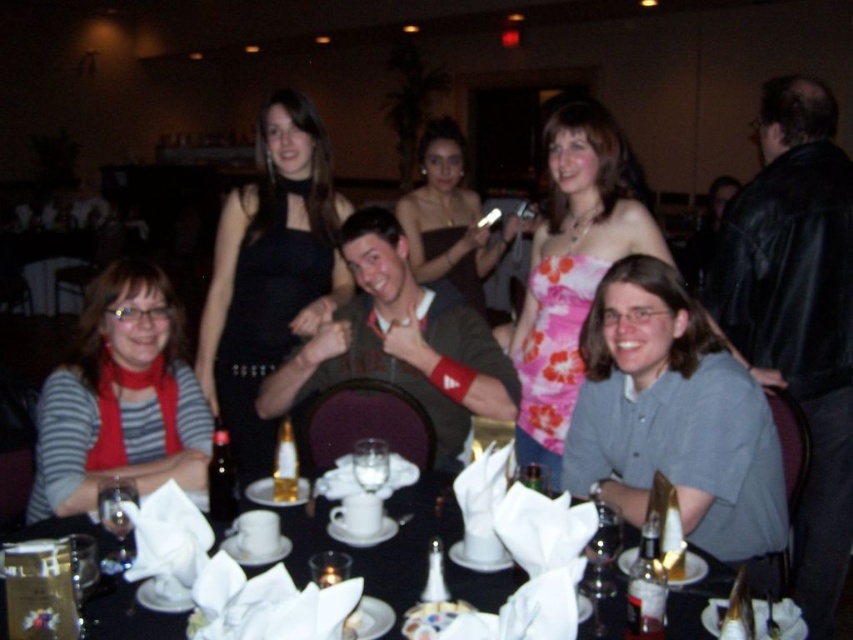
You are a photographer standing at the camera position. You want to take a photo of the person wearing the matte black dress at left. Considering the distance between you and the dress, will you be able to capture the entire dress in your shot without zooming in?

The distance between the matte black dress at left and the camera is 1.78 meters. Whether you can capture the entire dress without zooming depends on your camera lens. If your lens has a wide enough angle to cover the dress at that distance, then yes. Otherwise, you might need to adjust your position or use a wider lens.

You are a photographer at the event and need to capture a clear photo of the black satin dress at center without the matte black dress at center blocking it. Based on their positions, is this possible?

The black satin dress at center is in front of the matte black dress at center, so it is possible to capture a clear photo of the black satin dress at center without the matte black dress at center blocking it.

You are a photographer at the event and need to adjust the seating arrangement to ensure all guests can be captured in a group photo. The photographer notices that the matte black dress at left and the matte black dress at center are close to the camera. Which guest wearing a matte black dress is closer to the camera?

The matte black dress at left is closer to the camera than the matte black dress at center because it is positioned further to the left, which in this arrangement typically indicates proximity to the camera.